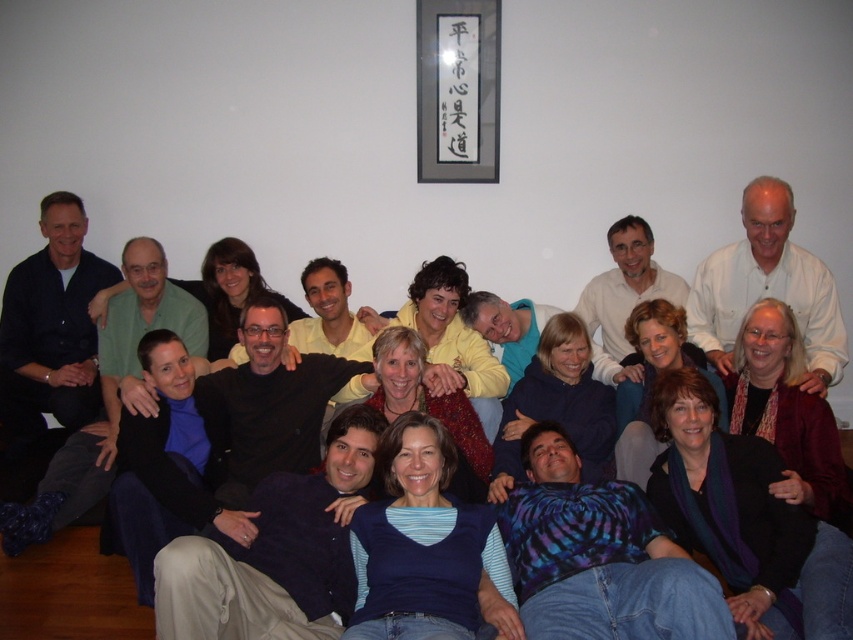
In the group photo, there are two notable clothing items visible. The matte black jacket at center and the white matte shirt at upper right. Which clothing item is positioned to the left of the other?

The matte black jacket at center is positioned to the left of the white matte shirt at upper right.

You are a photographer trying to adjust the lighting for the group photo. You notice the matte black jacket at center and the white matte shirt at upper right. Which object requires more light to ensure proper exposure?

The matte black jacket at center requires more light because it is much taller than the white matte shirt at upper right, meaning it may absorb more light and appear darker in the photo.